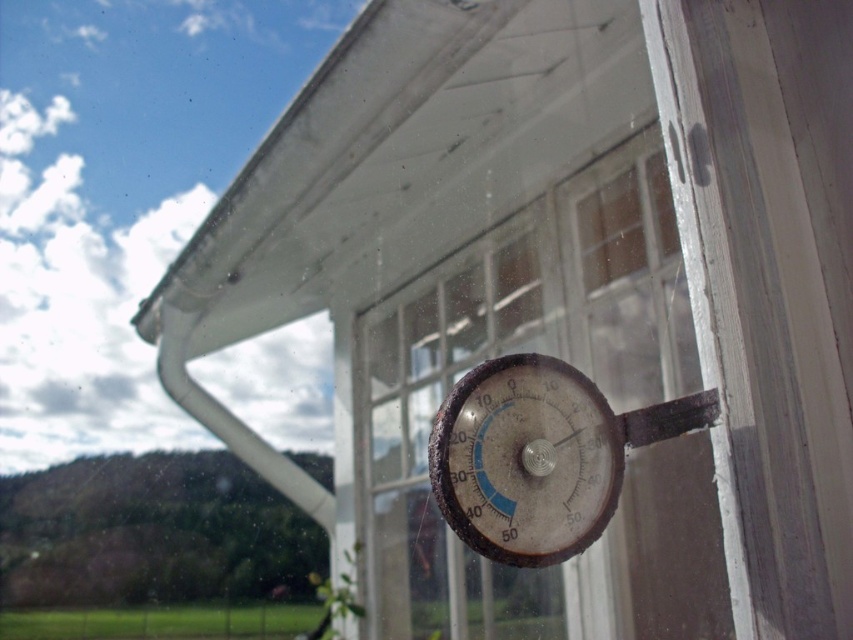
Question: Observing the image, what is the correct spatial positioning of transparent glass thermometer at center in reference to rusty metal thermometer at center?

Choices:
 (A) below
 (B) above

Answer: (B)

Question: Which of the following is the farthest from the observer?

Choices:
 (A) (448, 628)
 (B) (479, 467)

Answer: (B)

Question: Which point is farther from the camera taking this photo?

Choices:
 (A) (502, 224)
 (B) (451, 458)

Answer: (A)

Question: Can you confirm if transparent glass thermometer at center is smaller than rusty metal thermometer at center?

Choices:
 (A) no
 (B) yes

Answer: (A)

Question: Is transparent glass thermometer at center below rusty metal thermometer at center?

Choices:
 (A) no
 (B) yes

Answer: (A)

Question: Which point is closer to the camera taking this photo?

Choices:
 (A) (514, 444)
 (B) (694, 596)

Answer: (A)